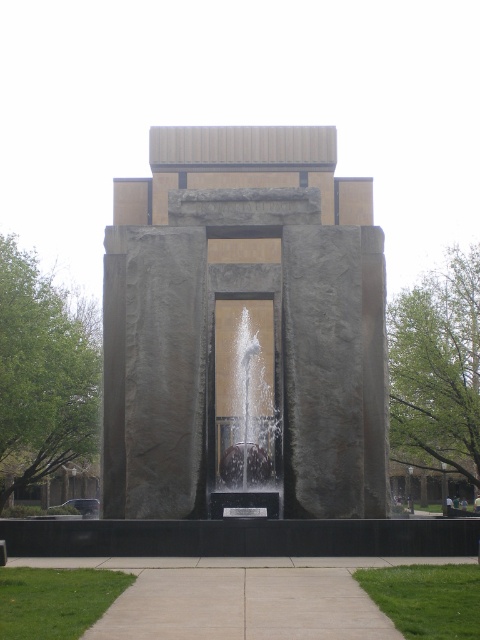
Question: Does gray stone fountain at center have a larger size compared to smooth concrete pavement at center?

Choices:
 (A) no
 (B) yes

Answer: (B)

Question: Among these points, which one is farthest from the camera?

Choices:
 (A) (332, 595)
 (B) (145, 426)
 (C) (255, 333)

Answer: (C)

Question: Which point is farther to the camera?

Choices:
 (A) gray stone fountain at center
 (B) clear glass water at center

Answer: (B)

Question: Is gray stone fountain at center to the right of smooth concrete pavement at center from the viewer's perspective?

Choices:
 (A) yes
 (B) no

Answer: (A)

Question: Which object appears closest to the camera in this image?

Choices:
 (A) gray stone fountain at center
 (B) clear glass water at center
 (C) smooth concrete pavement at center

Answer: (C)

Question: Can you confirm if gray stone fountain at center is positioned below smooth concrete pavement at center?

Choices:
 (A) yes
 (B) no

Answer: (B)